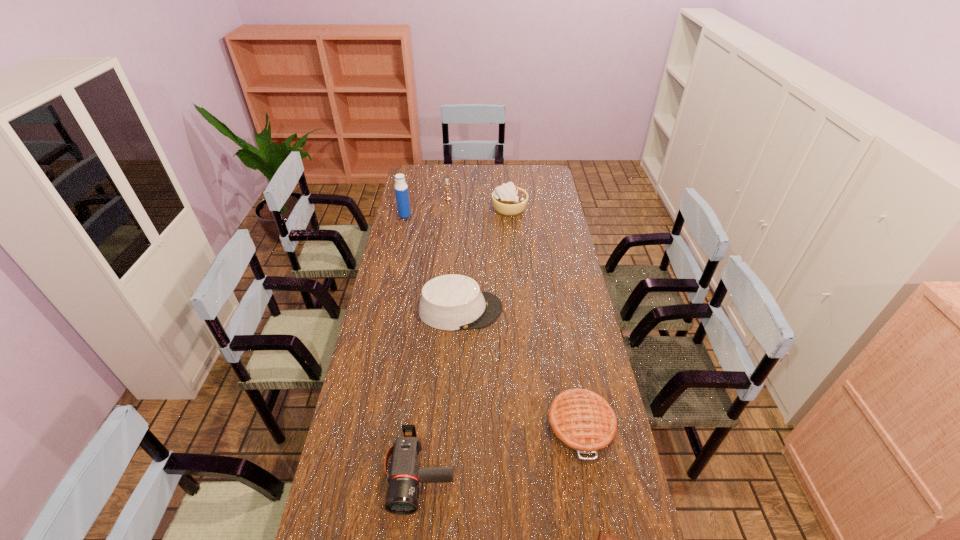
The width and height of the screenshot is (960, 540). I want to click on empty space between the whipped cream and the tallest object, so click(457, 212).

Identify the location of vacant region between the candle holder and the pie. The height and width of the screenshot is (540, 960). coord(515,312).

Where is `free space between the leftmost object and the camcorder`? The width and height of the screenshot is (960, 540). free space between the leftmost object and the camcorder is located at coordinates (413, 344).

Identify the location of free space between the whipped cream and the camcorder. The image size is (960, 540). coord(465,341).

Point out which object is positioned as the third nearest to the pie. Please provide its 2D coordinates. Your answer should be formatted as a tuple, i.e. [(x, y)], where the tuple contains the x and y coordinates of a point satisfying the conditions above.

[(451, 302)]

Identify which object is the closest to the hat. Please provide its 2D coordinates. Your answer should be formatted as a tuple, i.e. [(x, y)], where the tuple contains the x and y coordinates of a point satisfying the conditions above.

[(582, 421)]